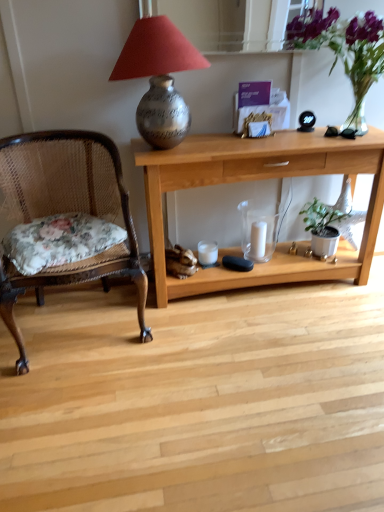
Find the location of a particular element. The width and height of the screenshot is (384, 512). vacant area to the right of woven wood chair with floral cushion at left is located at coordinates (193, 345).